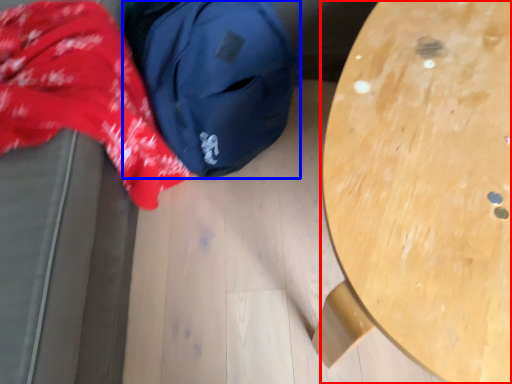
Question: Which of the following is the closest to the observer, table (highlighted by a red box) or backpack (highlighted by a blue box)?

Choices:
 (A) table
 (B) backpack

Answer: (A)